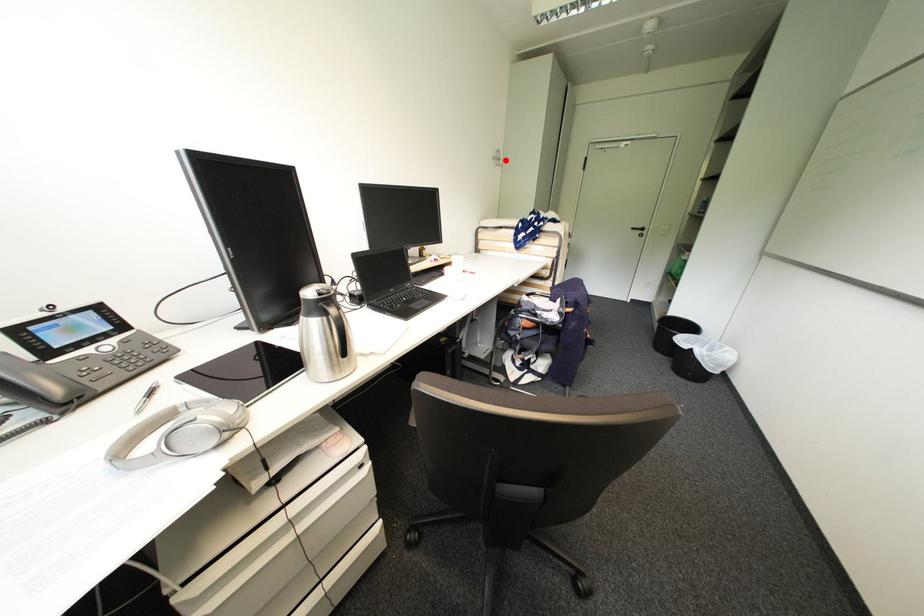
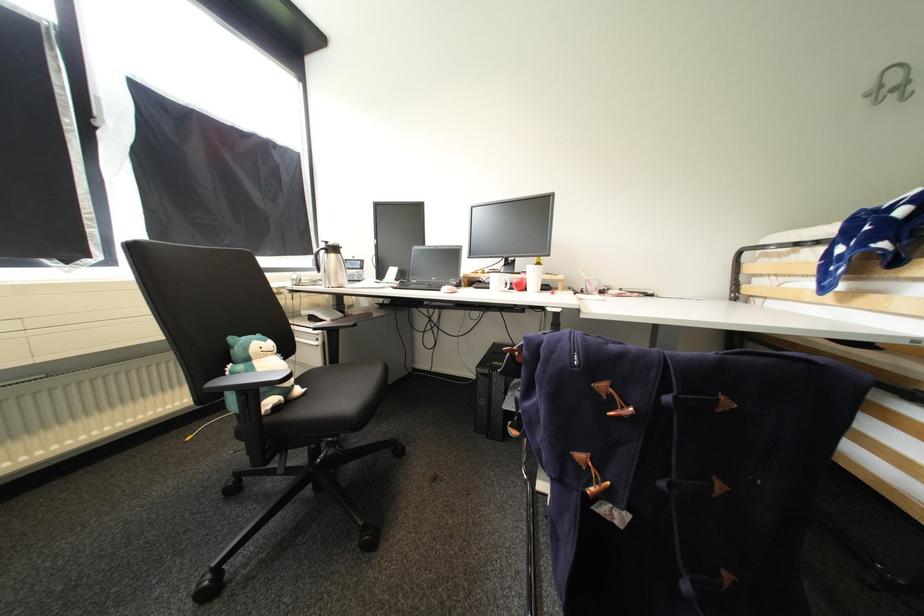
In the second image, find the point that corresponds to the highlighted location in the first image.

(912, 84)